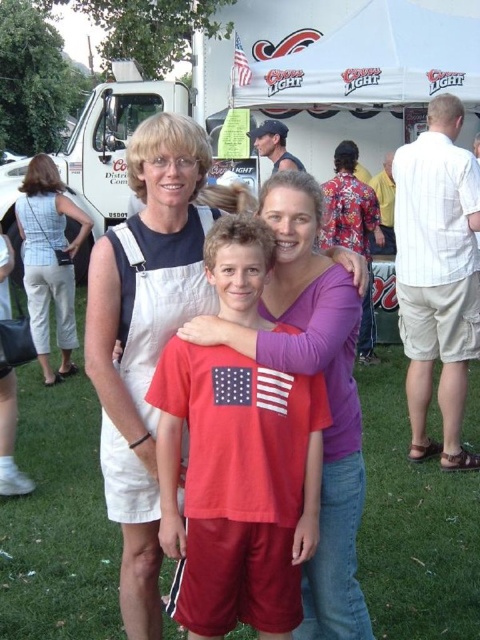
Between white cotton overalls at center and white cotton apron at center, which one appears on the left side from the viewer's perspective?

From the viewer's perspective, white cotton overalls at center appears more on the left side.

Between white cotton overalls at center and white cotton apron at center, which one is positioned lower?

white cotton overalls at center is lower down.

Where is `white cotton overalls at center`? The image size is (480, 640). white cotton overalls at center is located at coordinates (144, 337).

Does white cotton apron at center have a smaller size compared to american flag at upper center?

No, white cotton apron at center is not smaller than american flag at upper center.

The image size is (480, 640). What do you see at coordinates (157, 296) in the screenshot?
I see `white cotton apron at center` at bounding box center [157, 296].

You are a GUI agent. You are given a task and a screenshot of the screen. Output one action in this format:
    pyautogui.click(x=<x>, y=<y>)
    Task: Click on the white cotton apron at center
    This screenshot has width=480, height=640.
    Given the screenshot: What is the action you would take?
    pyautogui.click(x=157, y=296)

Is white cotton overalls at center above white cotton overalls at left?

Incorrect, white cotton overalls at center is not positioned above white cotton overalls at left.

Looking at this image, measure the distance between point (155, 476) and camera.

Point (155, 476) is 2.72 meters away from camera.

I want to click on white cotton overalls at center, so click(144, 337).